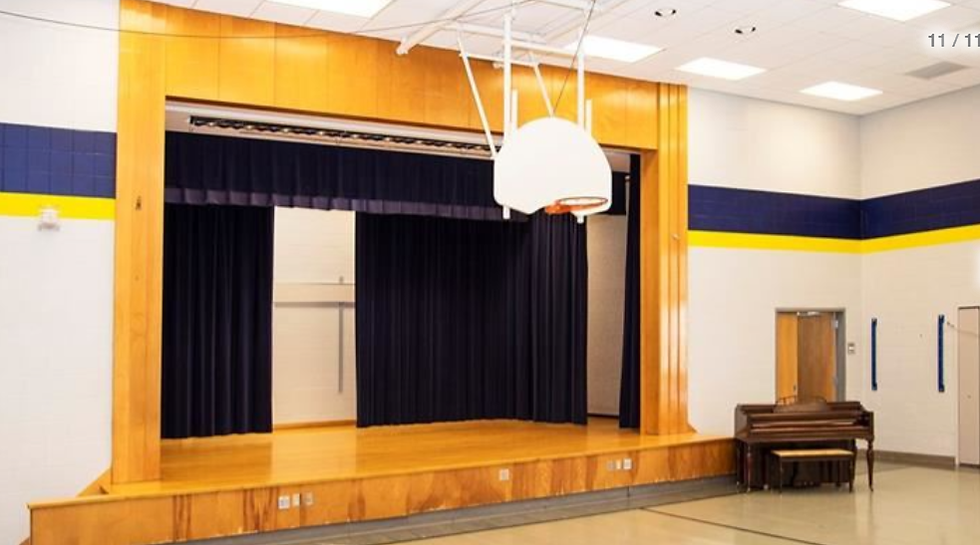
Where is `piano seat`? piano seat is located at coordinates (788, 453).